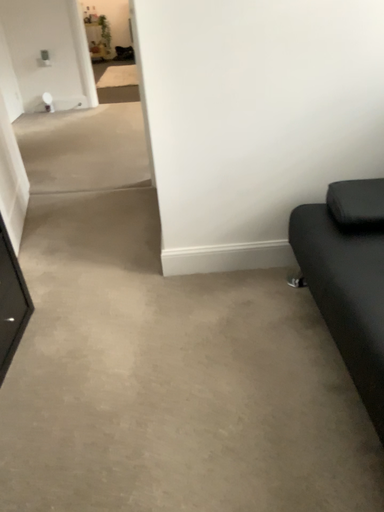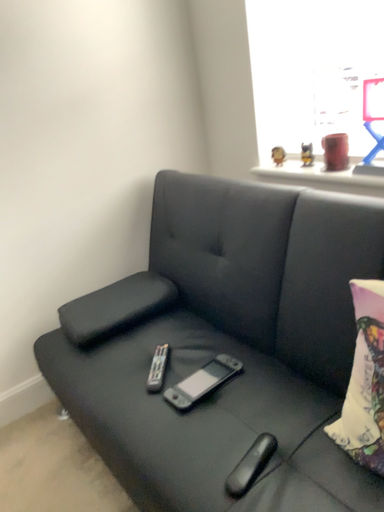
Question: How did the camera likely rotate when shooting the video?

Choices:
 (A) rotated left
 (B) rotated right

Answer: (B)